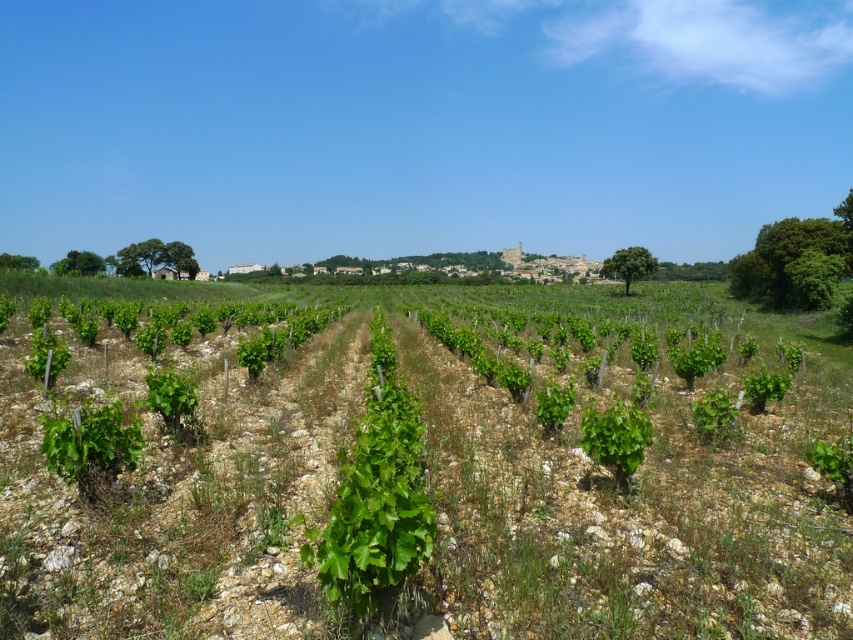
You are standing in the vineyard looking towards the village. There are two points marked in the image. Which point is closer to you, point (625,419) or point (184,372)?

Point (625,419) is closer to you than point (184,372).

You are standing at the point with coordinates (616, 438) in the vineyard. What object is exactly at your current location?

The green leafy plant at center is exactly at the point (616, 438).